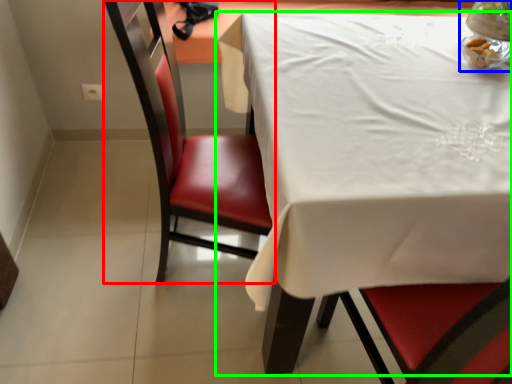
Question: Estimate the real-world distances between objects in this image. Which object is farther from chair (highlighted by a red box), tableware (highlighted by a blue box) or table (highlighted by a green box)?

Choices:
 (A) tableware
 (B) table

Answer: (A)